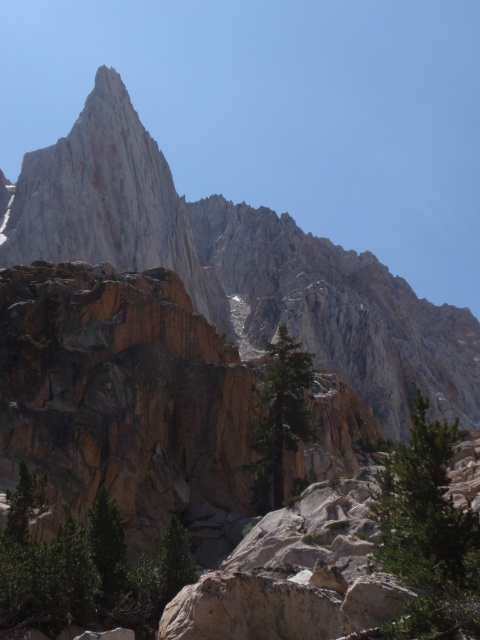
You are a hiker standing at the base of the rugged granite peak at upper center. You want to reach the summit. If your average hiking pace is 2.5 miles per hour, how long would it take you to reach the summit, assuming the path is straight and you maintain this pace?

The distance of rugged granite peak at upper center from viewer is 415.24 feet. Converting this to miles, 415.24 feet is approximately 0.0787 miles. At a pace of 2.5 miles per hour, the time required would be distance divided by speed, so 0.0787 miles divided by 2.5 mph equals approximately 0.0315 hours. Converting hours to minutes by multiplying by 60 gives roughly 1.89 minutes. Therefore, it would take about 1.9 minutes to reach the summit.

You are a hiker planning to take a photo of the rugged granite peak at upper center and the green textured tree at center. If you want both subjects to be clearly visible in the frame, which one should you focus on first to ensure proper focus?

You should focus on the rugged granite peak at upper center first because its width is larger than the green textured tree at center, making it easier to capture in focus.

You are a hiker standing in the rugged mountainous landscape. You see the green matte tree at lower left and the green textured rock at lower right. Which object is closer to you?

The green matte tree at lower left is closer to you because it is further to the viewer than the green textured rock at lower right.